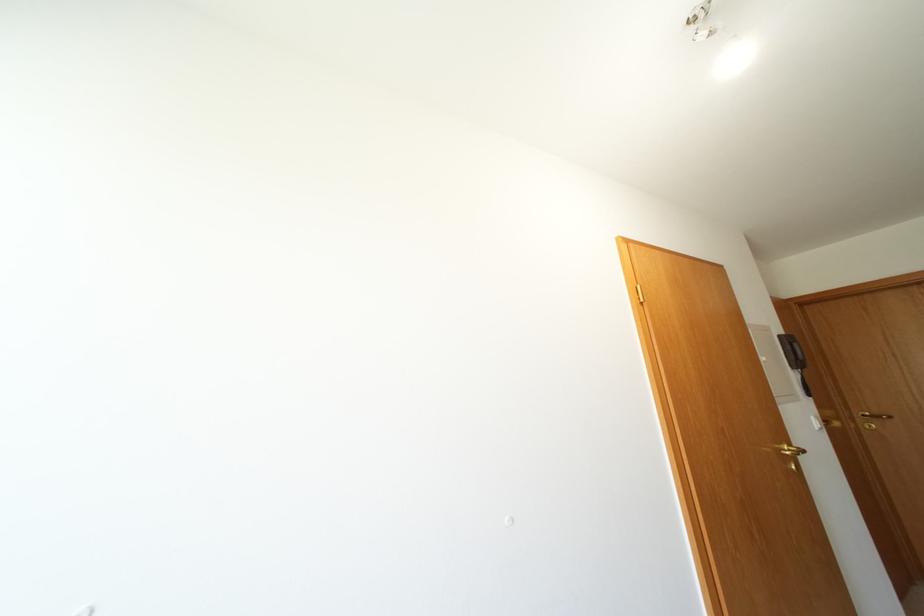
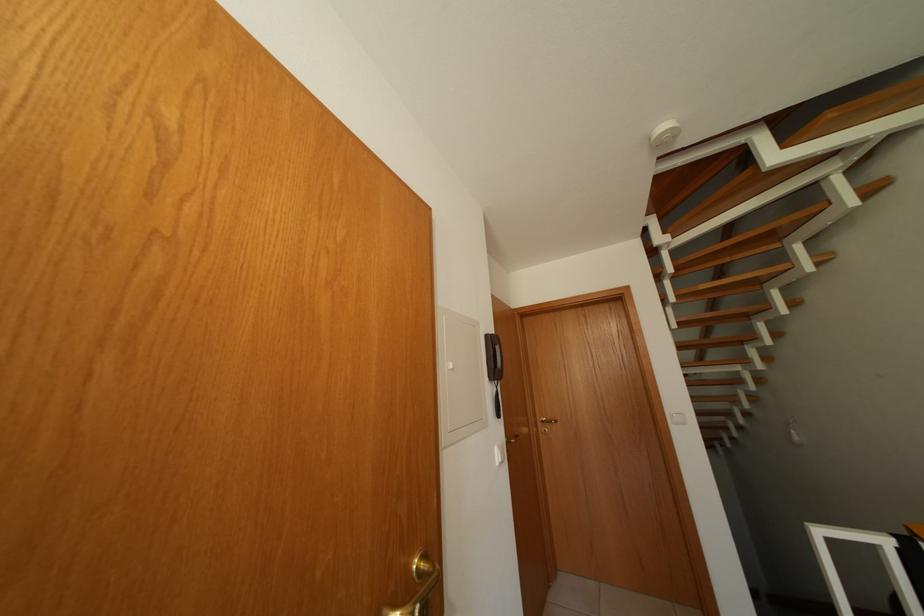
Find the pixel in the second image that matches point 796,345 in the first image.

(500, 346)